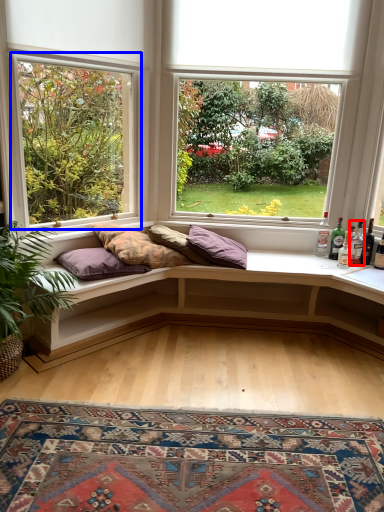
Question: Which object appears farthest to the camera in this image, bottle (highlighted by a red box) or window (highlighted by a blue box)?

Choices:
 (A) bottle
 (B) window

Answer: (A)